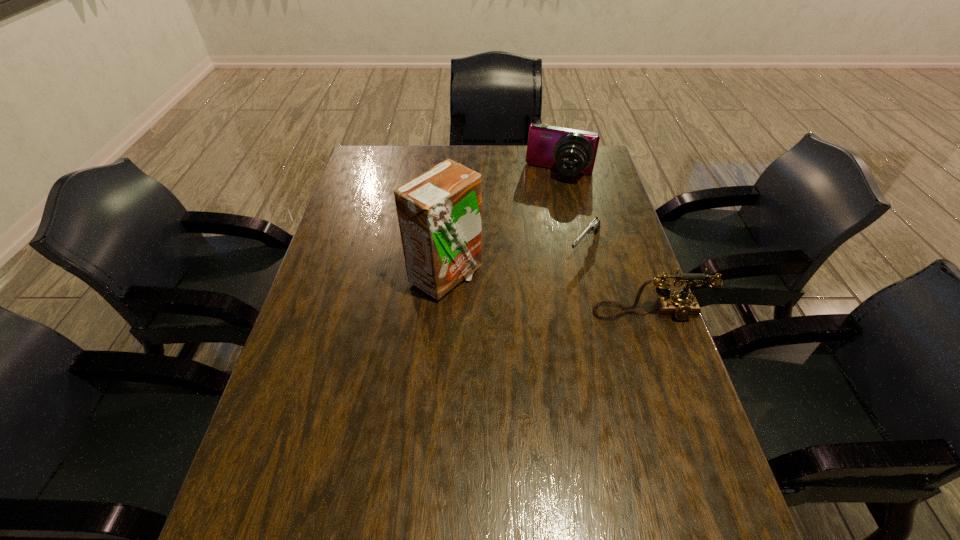
Locate an element on the screen. This screenshot has width=960, height=540. free spot between the shortest object and the carton is located at coordinates (516, 261).

Locate an element on the screen. The image size is (960, 540). vacant region between the second farthest object and the telephone is located at coordinates (542, 258).

Identify the location of vacant area between the shortest object and the tallest object. (516, 261).

Image resolution: width=960 pixels, height=540 pixels. In order to click on empty space that is in between the farthest object and the telephone in this screenshot , I will do `click(605, 244)`.

At what (x,y) coordinates should I click in order to perform the action: click on vacant area that lies between the camera and the pistol. Please return your answer as a coordinate pair (x, y). Image resolution: width=960 pixels, height=540 pixels. Looking at the image, I should click on (572, 210).

Identify which object is the closest to the telephone. Please provide its 2D coordinates. Your answer should be formatted as a tuple, i.e. [(x, y)], where the tuple contains the x and y coordinates of a point satisfying the conditions above.

[(594, 226)]

Point out which object is positioned as the fourth nearest to the tallest object. Please provide its 2D coordinates. Your answer should be formatted as a tuple, i.e. [(x, y)], where the tuple contains the x and y coordinates of a point satisfying the conditions above.

[(571, 151)]